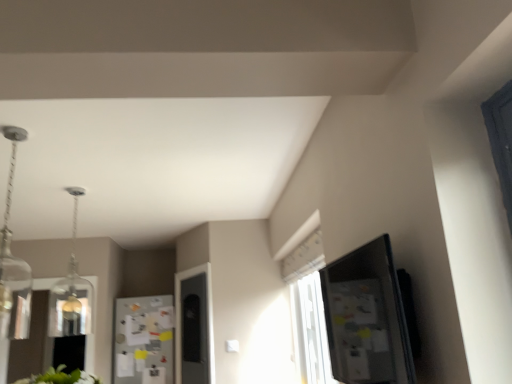
Question: Is clear glass pendant at upper left, the 1th light fixture from the front, smaller than clear glass pendant light at upper left, which appears as the 2th light fixture when viewed from the front?

Choices:
 (A) yes
 (B) no

Answer: (A)

Question: Is clear glass pendant light at upper left, which appears as the 2th light fixture when viewed from the front, at the back of clear glass pendant at upper left, the second light fixture positioned from the back?

Choices:
 (A) no
 (B) yes

Answer: (A)

Question: From a real-world perspective, is clear glass pendant at upper left, the 1th light fixture from the front, on top of clear glass pendant light at upper left, which ranks as the first light fixture in back-to-front order?

Choices:
 (A) no
 (B) yes

Answer: (B)

Question: Does clear glass pendant at upper left, the 1th light fixture from the front, have a greater width compared to clear glass pendant light at upper left, which ranks as the first light fixture in back-to-front order?

Choices:
 (A) yes
 (B) no

Answer: (B)

Question: Are clear glass pendant at upper left, the 1th light fixture from the front, and clear glass pendant light at upper left, which ranks as the first light fixture in back-to-front order, making contact?

Choices:
 (A) yes
 (B) no

Answer: (B)

Question: Visually, is clear glass pendant light at upper left, which appears as the 2th light fixture when viewed from the front, positioned to the left or to the right of clear glass pendant at upper left, the 1th light fixture from the front?

Choices:
 (A) right
 (B) left

Answer: (B)

Question: Is clear glass pendant light at upper left, which appears as the 2th light fixture when viewed from the front, wider or thinner than clear glass pendant at upper left, the second light fixture positioned from the back?

Choices:
 (A) thin
 (B) wide

Answer: (B)

Question: Relative to clear glass pendant at upper left, the 1th light fixture from the front, is clear glass pendant light at upper left, which ranks as the first light fixture in back-to-front order, in front or behind?

Choices:
 (A) behind
 (B) front

Answer: (A)

Question: Considering the positions of clear glass pendant light at upper left, which ranks as the first light fixture in back-to-front order, and clear glass pendant at upper left, the 1th light fixture from the front, in the image, is clear glass pendant light at upper left, which ranks as the first light fixture in back-to-front order, taller or shorter than clear glass pendant at upper left, the 1th light fixture from the front,?

Choices:
 (A) short
 (B) tall

Answer: (B)

Question: Is white paperboard fridge at center taller or shorter than clear glass pendant at upper left, the second light fixture positioned from the back?

Choices:
 (A) short
 (B) tall

Answer: (B)

Question: Is white paperboard fridge at center situated inside clear glass pendant at upper left, the second light fixture positioned from the back, or outside?

Choices:
 (A) outside
 (B) inside

Answer: (A)

Question: Considering their positions, is white paperboard fridge at center located in front of or behind clear glass pendant at upper left, the 1th light fixture from the front?

Choices:
 (A) behind
 (B) front

Answer: (A)

Question: Does point (117, 344) appear closer or farther from the camera than point (11, 258)?

Choices:
 (A) closer
 (B) farther

Answer: (B)

Question: From a real-world perspective, is clear glass pendant at upper left, the 1th light fixture from the front, above or below white paperboard fridge at center?

Choices:
 (A) above
 (B) below

Answer: (A)

Question: Considering the positions of clear glass pendant at upper left, the 1th light fixture from the front, and white paperboard fridge at center in the image, is clear glass pendant at upper left, the 1th light fixture from the front, wider or thinner than white paperboard fridge at center?

Choices:
 (A) thin
 (B) wide

Answer: (B)